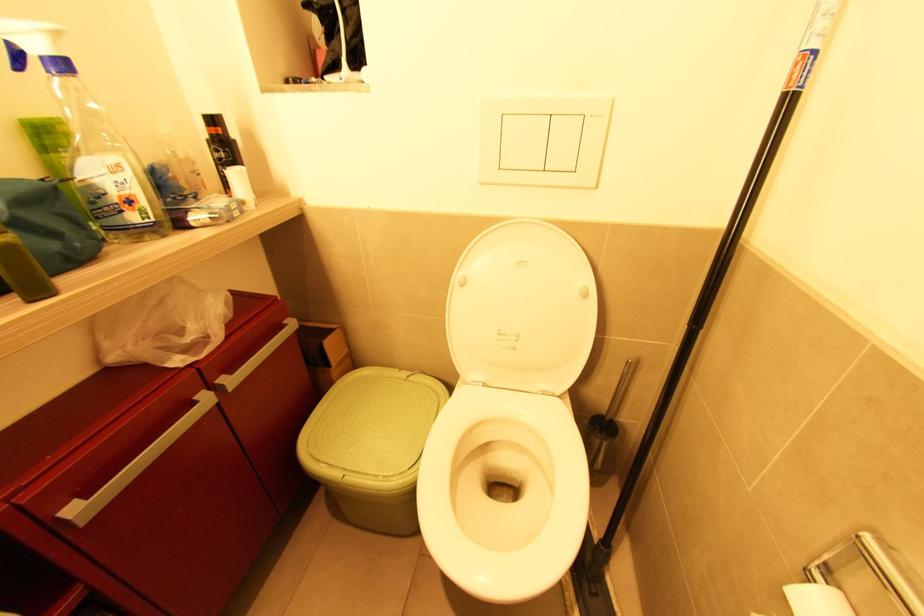
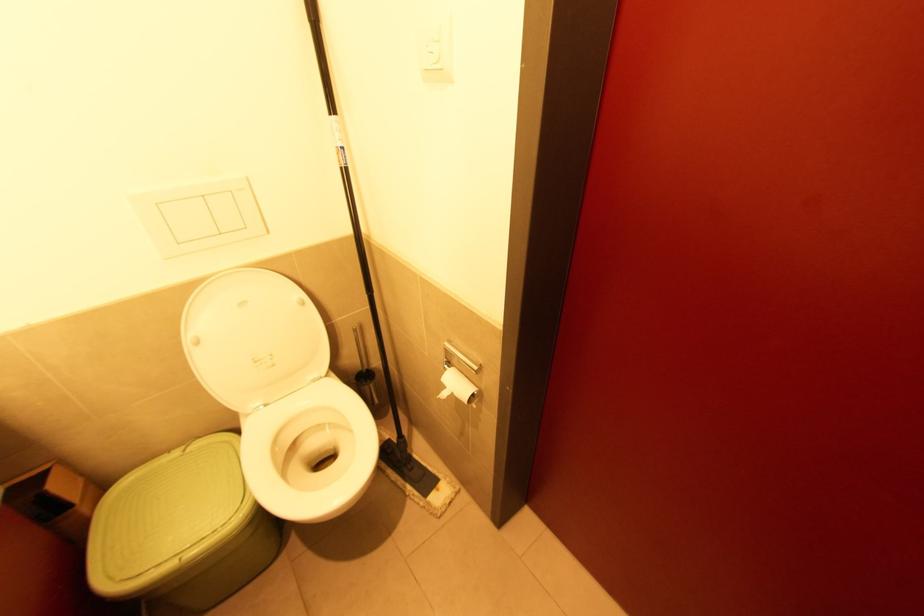
Where in the second image is the point corresponding to (x=792, y=103) from the first image?

(347, 172)